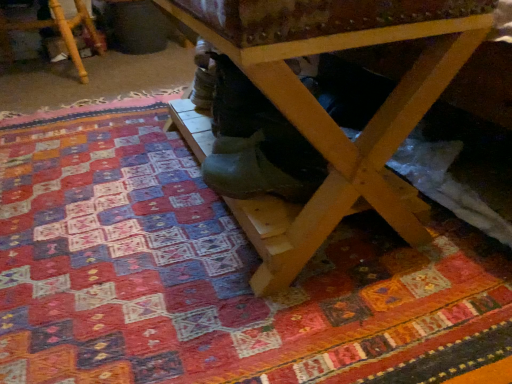
Question: Is green rubber boot at center to the right of wooden stool at lower left from the viewer's perspective?

Choices:
 (A) no
 (B) yes

Answer: (B)

Question: Is green rubber boot at center not near wooden stool at lower left?

Choices:
 (A) no
 (B) yes

Answer: (B)

Question: Would you say green rubber boot at center is outside wooden stool at lower left?

Choices:
 (A) yes
 (B) no

Answer: (A)

Question: From the image's perspective, is green rubber boot at center located beneath wooden stool at lower left?

Choices:
 (A) yes
 (B) no

Answer: (A)

Question: Is green rubber boot at center smaller than wooden stool at lower left?

Choices:
 (A) no
 (B) yes

Answer: (B)

Question: Is green rubber boot at center facing away from wooden stool at lower left?

Choices:
 (A) no
 (B) yes

Answer: (A)

Question: Considering the relative sizes of wooden stool at lower left and wooden table at center in the image provided, is wooden stool at lower left shorter than wooden table at center?

Choices:
 (A) no
 (B) yes

Answer: (B)

Question: Can you confirm if wooden stool at lower left is thinner than wooden table at center?

Choices:
 (A) yes
 (B) no

Answer: (B)

Question: Is wooden table at center at the back of wooden stool at lower left?

Choices:
 (A) no
 (B) yes

Answer: (A)

Question: Does wooden stool at lower left appear on the right side of wooden table at center?

Choices:
 (A) yes
 (B) no

Answer: (B)

Question: Is wooden stool at lower left at the left side of wooden table at center?

Choices:
 (A) yes
 (B) no

Answer: (A)

Question: Is wooden stool at lower left positioned far away from wooden table at center?

Choices:
 (A) no
 (B) yes

Answer: (B)

Question: Does wooden table at center appear on the left side of wooden stool at lower left?

Choices:
 (A) no
 (B) yes

Answer: (A)